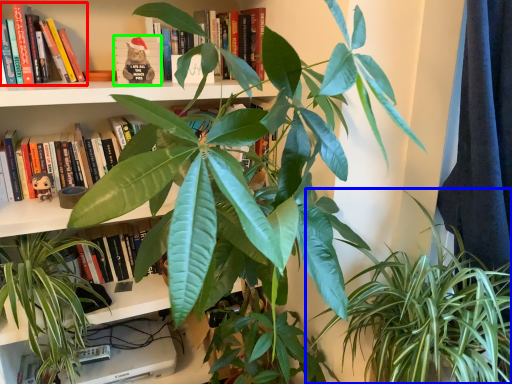
Question: Based on their relative distances, which object is farther from book (highlighted by a red box)? Choose from houseplant (highlighted by a blue box) and paperback book (highlighted by a green box).

Choices:
 (A) houseplant
 (B) paperback book

Answer: (A)